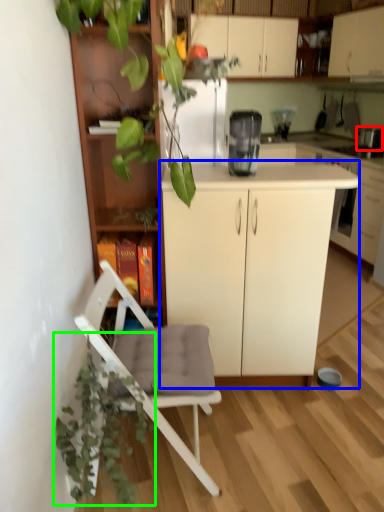
Question: Considering the real-world distances, which object is closest to appliance (highlighted by a red box)? cabinetry (highlighted by a blue box) or vegetation (highlighted by a green box).

Choices:
 (A) cabinetry
 (B) vegetation

Answer: (A)